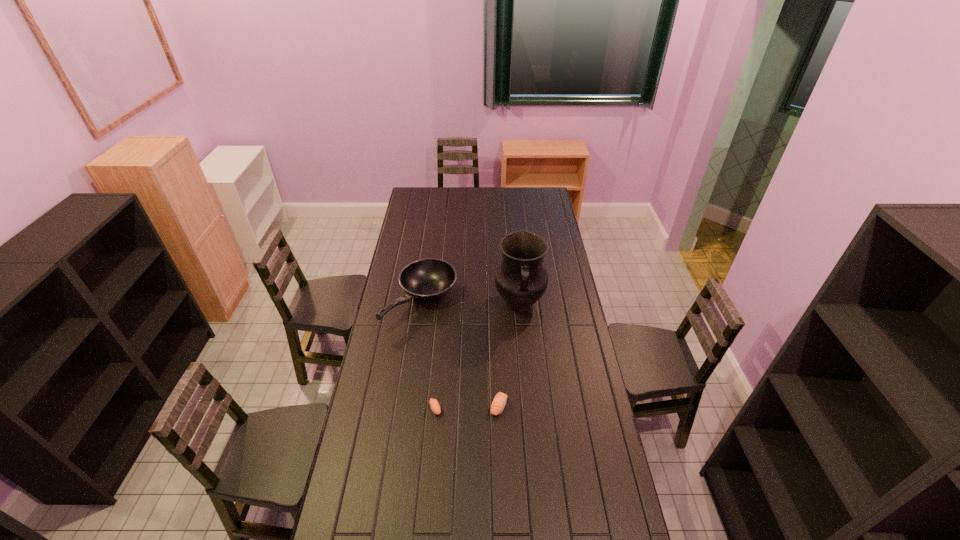
This screenshot has width=960, height=540. I want to click on the tallest object, so click(521, 280).

You are a GUI agent. You are given a task and a screenshot of the screen. Output one action in this format:
    pyautogui.click(x=<x>, y=<y>)
    Task: Click on the second tallest object
    This screenshot has height=540, width=960.
    Given the screenshot: What is the action you would take?
    pyautogui.click(x=426, y=279)

The image size is (960, 540). Identify the location of the right sushi. (499, 402).

Locate an element on the screen. the left sushi is located at coordinates (435, 407).

Where is `vacant space located 0.340m on the handle side of the tallest object`? vacant space located 0.340m on the handle side of the tallest object is located at coordinates [527, 386].

Identify the location of vacant position located on the front of the second tallest object. (413, 360).

Find the location of a particular element. The image size is (960, 540). vacant space positioned 0.390m on the front of the right sushi is located at coordinates (503, 530).

Find the location of a particular element. The width and height of the screenshot is (960, 540). free location located 0.140m on the front of the left sushi is located at coordinates (432, 453).

Identify the location of object at the left edge. This screenshot has width=960, height=540. (426, 279).

Locate an element on the screen. The height and width of the screenshot is (540, 960). object at the right edge is located at coordinates (521, 280).